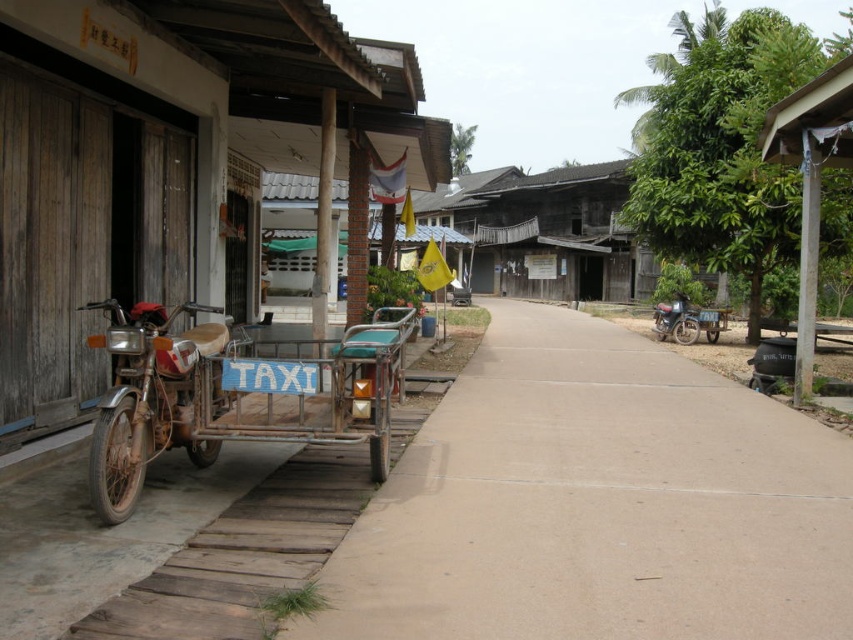
You are standing at the center of the rural street scene. There is a point marked at coordinates [167,163]. What object is located at that point?

The point at coordinates [167,163] is where the rusty metal tricycle at left is located.

You are a delivery person who needs to park your metallic blue motorcycle at right near the wooden hut at right. Is there enough space between them for a small package to fit through?

The wooden hut at right has a smaller size compared to the metallic blue motorcycle at right. Since the wooden hut at right is smaller, there might be enough space between them for a small package to pass through, but the exact dimensions aren